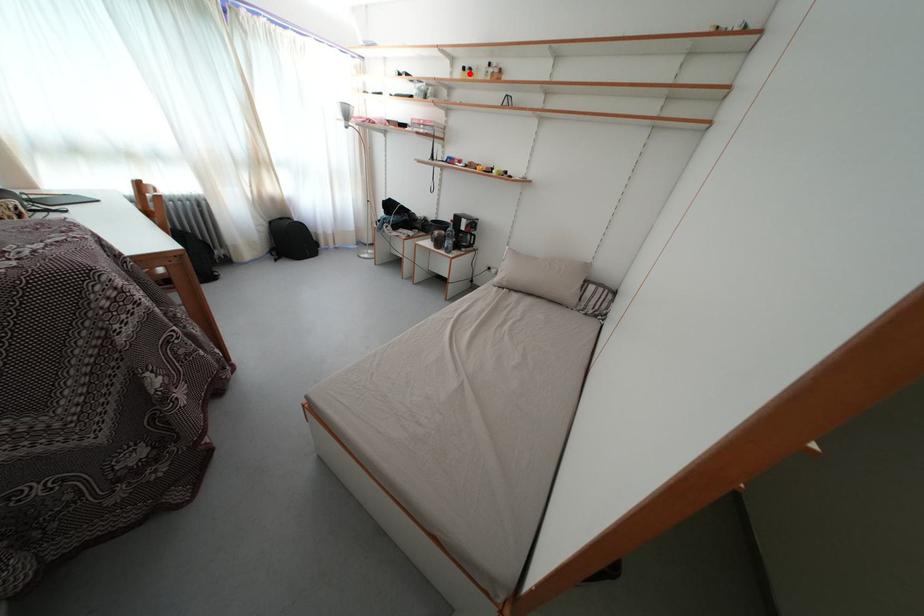
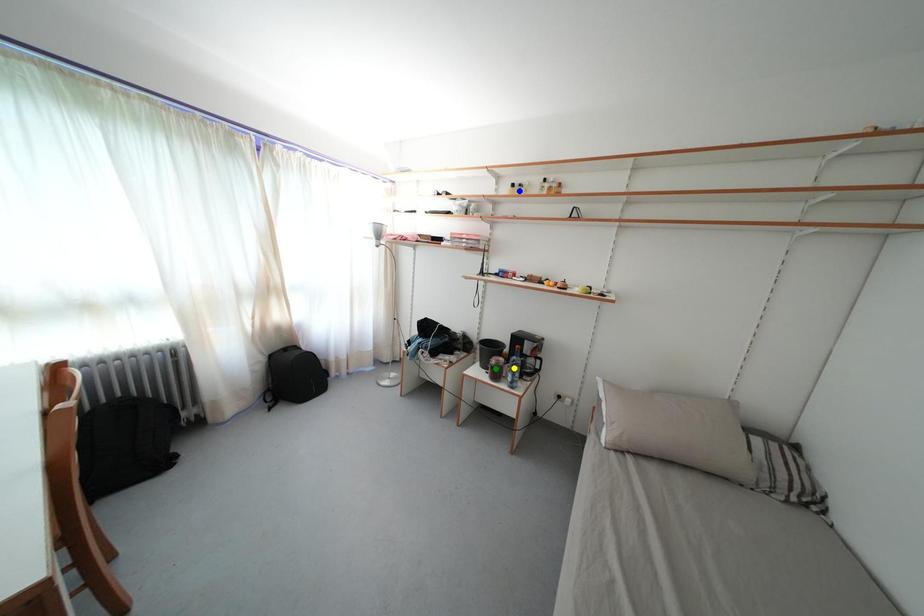
Question: I am providing you with two images of the same scene from different viewpoints. A red point is marked on the first image. You are given multiple points on the second image. Which point in image 2 represents the same 3d spot as the red point in image 1?

Choices:
 (A) blue point
 (B) green point
 (C) yellow point

Answer: (A)